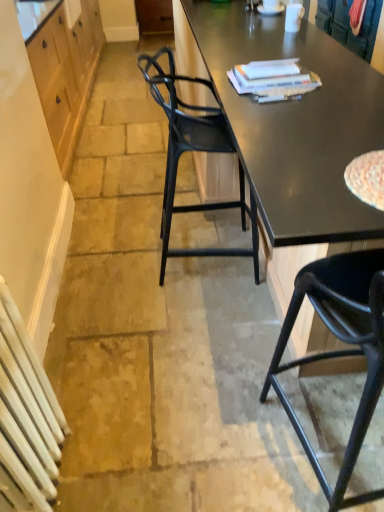
Question: Are black glossy desk at center and white painted metal radiator at lower left far apart?

Choices:
 (A) no
 (B) yes

Answer: (B)

Question: Would you say black glossy desk at center contains white painted metal radiator at lower left?

Choices:
 (A) yes
 (B) no

Answer: (B)

Question: Can you confirm if black glossy desk at center is positioned to the right of white painted metal radiator at lower left?

Choices:
 (A) no
 (B) yes

Answer: (B)

Question: Can you confirm if black glossy desk at center is thinner than white painted metal radiator at lower left?

Choices:
 (A) no
 (B) yes

Answer: (A)

Question: Is black glossy desk at center located outside white painted metal radiator at lower left?

Choices:
 (A) no
 (B) yes

Answer: (B)

Question: Is black glossy desk at center in front of white painted metal radiator at lower left?

Choices:
 (A) yes
 (B) no

Answer: (B)

Question: Could you tell me if black plastic chair at lower right, placed as the 1th chair when sorted from front to back, is turned towards white painted metal radiator at lower left?

Choices:
 (A) no
 (B) yes

Answer: (A)

Question: Does black plastic chair at lower right, placed as the 1th chair when sorted from front to back, have a larger size compared to white painted metal radiator at lower left?

Choices:
 (A) no
 (B) yes

Answer: (B)

Question: Does black plastic chair at lower right, placed as the 1th chair when sorted from front to back, contain white painted metal radiator at lower left?

Choices:
 (A) no
 (B) yes

Answer: (A)

Question: Is black plastic chair at lower right, placed as the 1th chair when sorted from front to back, positioned behind white painted metal radiator at lower left?

Choices:
 (A) no
 (B) yes

Answer: (A)

Question: Can you confirm if black plastic chair at lower right, which is the 2th chair in back-to-front order, is positioned to the right of white painted metal radiator at lower left?

Choices:
 (A) yes
 (B) no

Answer: (A)

Question: Are black plastic chair at lower right, which is the 2th chair in back-to-front order, and white painted metal radiator at lower left making contact?

Choices:
 (A) no
 (B) yes

Answer: (A)

Question: Is black glossy desk at center at the back of white glossy coffee cup at upper center?

Choices:
 (A) no
 (B) yes

Answer: (A)